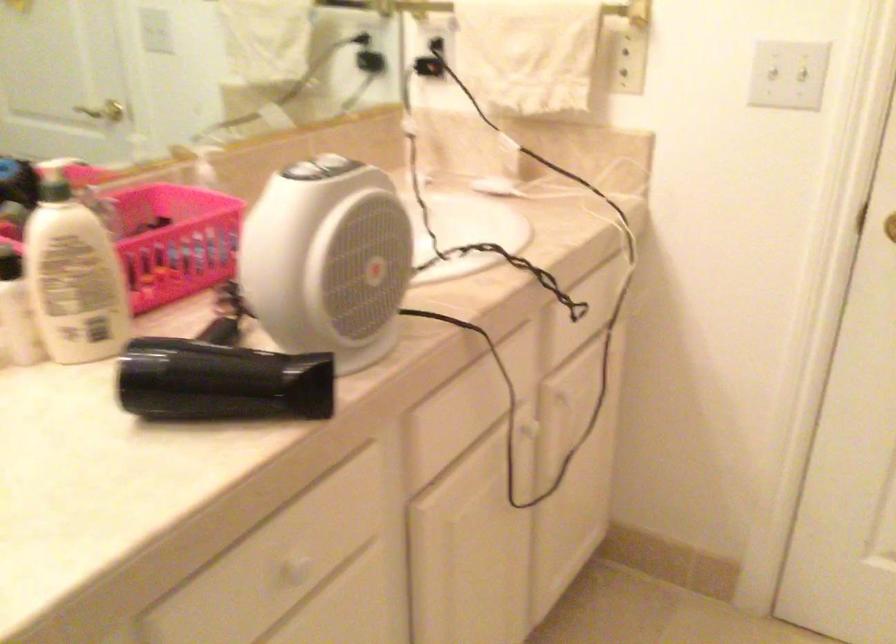
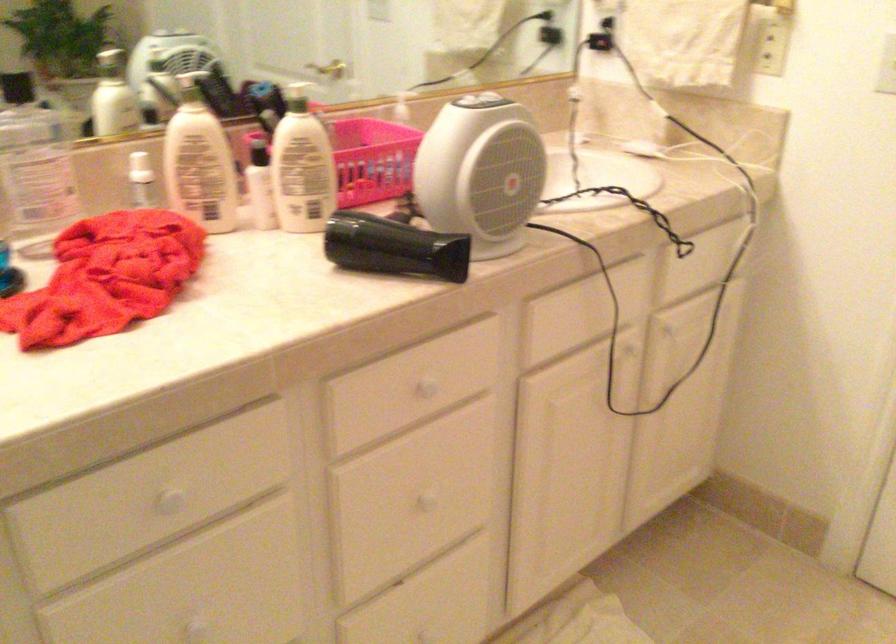
Locate, in the second image, the point that corresponds to point (334, 162) in the first image.

(484, 102)